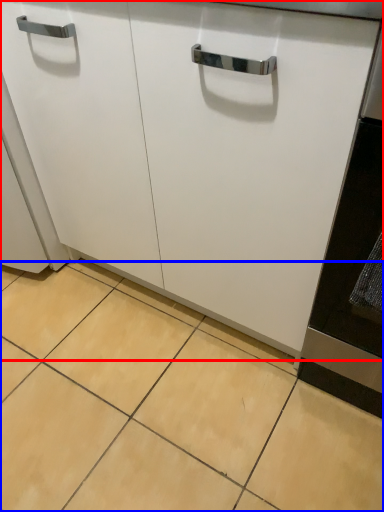
Question: Which object is further to the camera taking this photo, cabinetry (highlighted by a red box) or ceramic tile (highlighted by a blue box)?

Choices:
 (A) cabinetry
 (B) ceramic tile

Answer: (B)